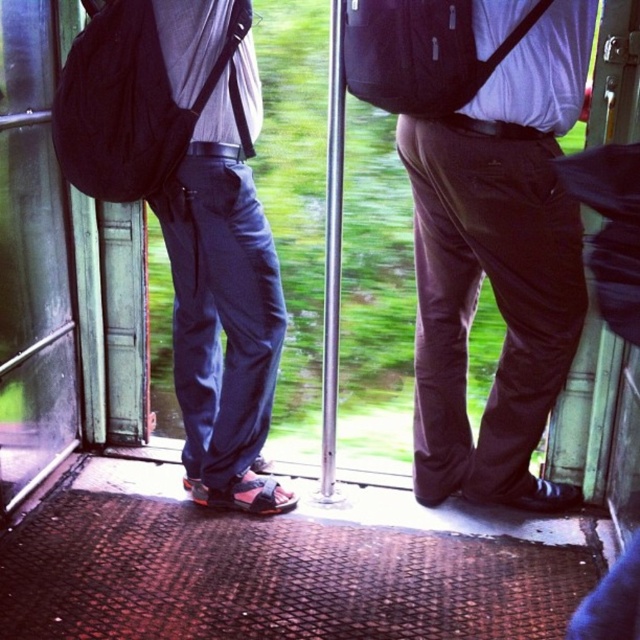
Question: Does matte black backpack at left appear on the right side of matte black backpack at center?

Choices:
 (A) yes
 (B) no

Answer: (B)

Question: Which point is farther to the camera?

Choices:
 (A) matte black backpack at center
 (B) matte black backpack at left

Answer: (B)

Question: Among these objects, which one is farthest from the camera?

Choices:
 (A) matte black backpack at center
 (B) matte black backpack at left

Answer: (B)

Question: Does matte black backpack at left appear on the left side of matte black backpack at center?

Choices:
 (A) yes
 (B) no

Answer: (A)

Question: Which object is farther from the camera taking this photo?

Choices:
 (A) matte black backpack at center
 (B) matte black backpack at left

Answer: (B)

Question: Is matte black backpack at left bigger than matte black backpack at center?

Choices:
 (A) no
 (B) yes

Answer: (B)